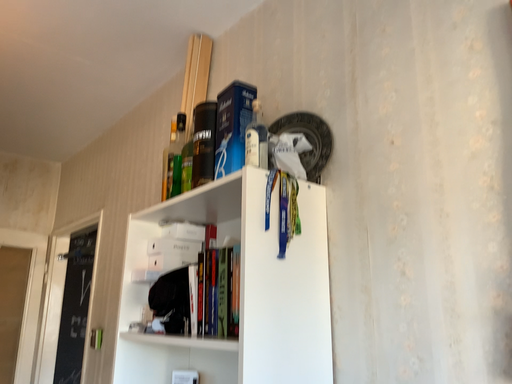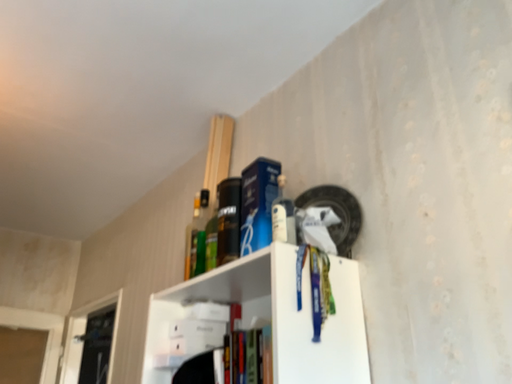
Question: How did the camera likely rotate when shooting the video?

Choices:
 (A) rotated upward
 (B) rotated downward

Answer: (A)